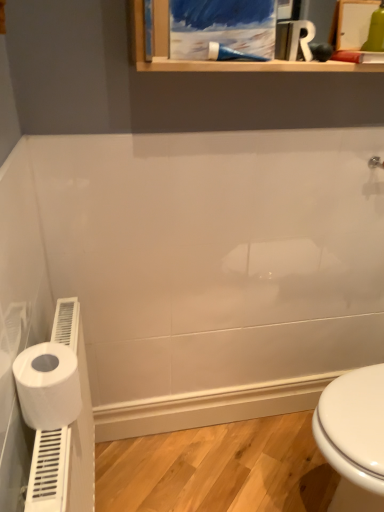
Question: Is white plastic toilet paper holder at lower left to the left or to the right of blue plastic shower at upper center in the image?

Choices:
 (A) right
 (B) left

Answer: (B)

Question: Is point (64, 442) positioned closer to the camera than point (211, 54)?

Choices:
 (A) closer
 (B) farther

Answer: (A)

Question: Considering the real-world distances, which object is farthest from the white matte toilet paper at left?

Choices:
 (A) blue plastic shower at upper center
 (B) white plastic toilet paper holder at lower left

Answer: (A)

Question: Based on their relative distances, which object is nearer to the white plastic toilet paper holder at lower left?

Choices:
 (A) blue plastic shower at upper center
 (B) white matte toilet paper at left

Answer: (B)